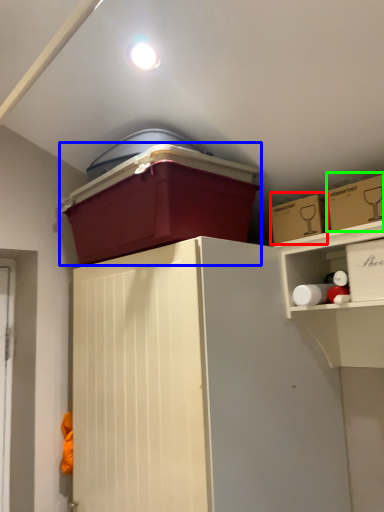
Question: Which object is the closest to the storage box (highlighted by a red box)? Choose among these: storage box (highlighted by a blue box) or storage box (highlighted by a green box).

Choices:
 (A) storage box
 (B) storage box

Answer: (B)